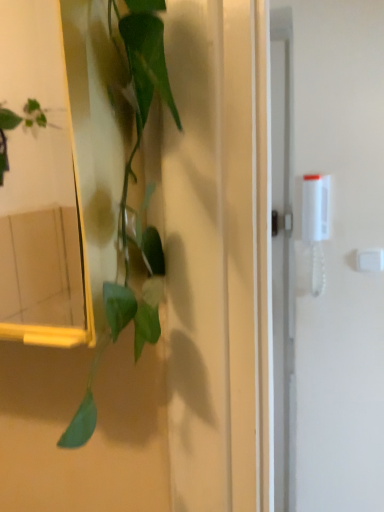
Question: Should I look upward or downward to see white plastic light switch at upper right?

Choices:
 (A) up
 (B) down

Answer: (B)

Question: Is green matte plant at left thinner than white plastic light switch at upper right?

Choices:
 (A) no
 (B) yes

Answer: (A)

Question: Does green matte plant at left have a smaller size compared to white plastic light switch at upper right?

Choices:
 (A) yes
 (B) no

Answer: (B)

Question: From the image's perspective, is green matte plant at left below white plastic light switch at upper right?

Choices:
 (A) no
 (B) yes

Answer: (A)

Question: Could you tell me if green matte plant at left is facing white plastic light switch at upper right?

Choices:
 (A) no
 (B) yes

Answer: (A)

Question: Is green matte plant at left taller than white plastic light switch at upper right?

Choices:
 (A) no
 (B) yes

Answer: (B)

Question: Is green matte plant at left outside of white plastic light switch at upper right?

Choices:
 (A) no
 (B) yes

Answer: (B)

Question: Does white plastic light switch at upper right have a lesser height compared to green matte plant at left?

Choices:
 (A) no
 (B) yes

Answer: (B)

Question: Are white plastic light switch at upper right and green matte plant at left far apart?

Choices:
 (A) no
 (B) yes

Answer: (B)

Question: From the image's perspective, would you say white plastic light switch at upper right is shown under green matte plant at left?

Choices:
 (A) yes
 (B) no

Answer: (A)

Question: Is white plastic light switch at upper right completely or partially outside of green matte plant at left?

Choices:
 (A) no
 (B) yes

Answer: (B)

Question: Does white plastic light switch at upper right have a smaller size compared to green matte plant at left?

Choices:
 (A) no
 (B) yes

Answer: (B)

Question: Is white plastic light switch at upper right thinner than green matte plant at left?

Choices:
 (A) no
 (B) yes

Answer: (B)

Question: Does point (160, 87) appear closer or farther from the camera than point (357, 258)?

Choices:
 (A) farther
 (B) closer

Answer: (B)